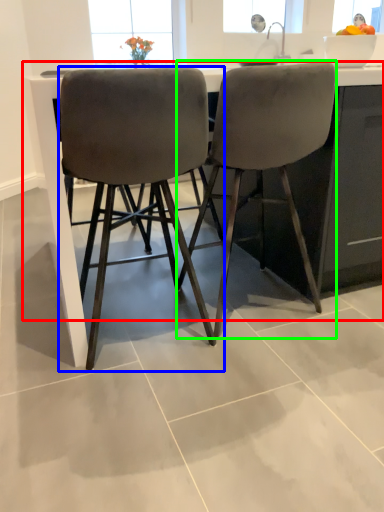
Question: Which object is positioned farthest from counter (highlighted by a red box)? Select from chair (highlighted by a blue box) and chair (highlighted by a green box).

Choices:
 (A) chair
 (B) chair

Answer: (B)